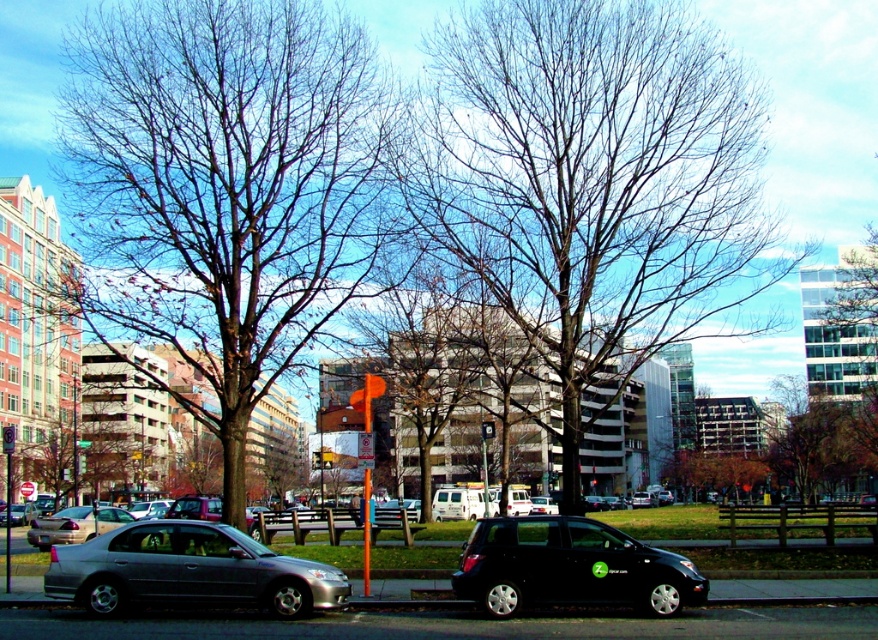
You are standing on the sidewalk in the city scene. You notice two points marked in the image. The first point is at coordinates point (x=545, y=157) and the second is at point (x=34, y=522). Which point is closer to you?

Point (x=545, y=157) is closer to the viewer than point (x=34, y=522).

You are a pedestrian standing on the sidewalk and want to cross the street to the green leafy tree at upper right. Which direction should you walk to avoid the metallic gray sedan at lower left?

The metallic gray sedan at lower left is to the left of the green leafy tree at upper right. To avoid the metallic gray sedan at lower left, you should walk to the right side of the street towards the green leafy tree at upper right.